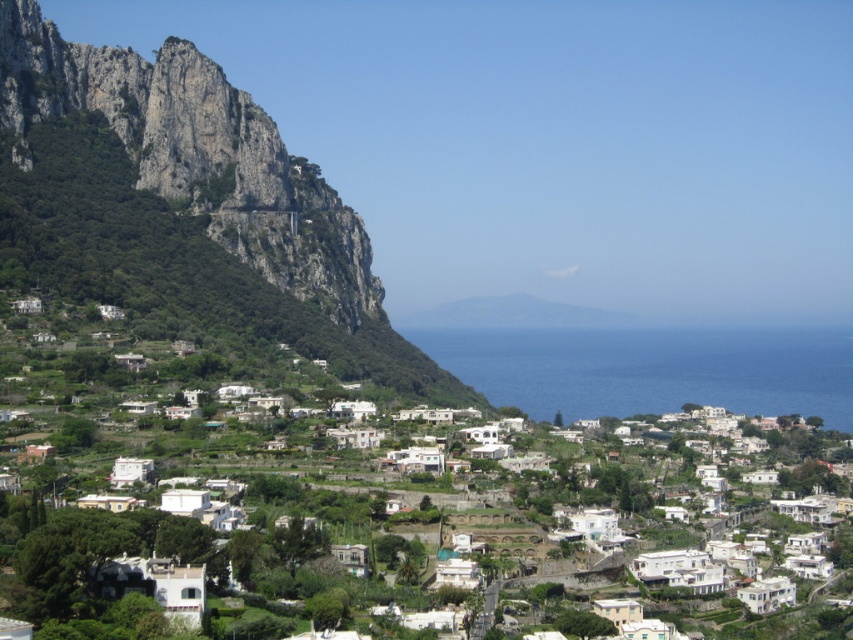
Does point (223, 83) come closer to viewer compared to point (712, 336)?

Yes, point (223, 83) is closer to viewer.

Does rugged stone mountain at left appear over white matte houses at center?

Correct, rugged stone mountain at left is located above white matte houses at center.

Measure the distance between rugged stone mountain at left and camera.

rugged stone mountain at left and camera are 820.08 feet apart.

Where is `rugged stone mountain at left`? The width and height of the screenshot is (853, 640). rugged stone mountain at left is located at coordinates (184, 204).

Can you confirm if rugged stone mountain at left is positioned above blue liquid water at center?

Indeed, rugged stone mountain at left is positioned over blue liquid water at center.

Which of these two, rugged stone mountain at left or blue liquid water at center, stands taller?

Standing taller between the two is rugged stone mountain at left.

I want to click on rugged stone mountain at left, so click(184, 204).

Image resolution: width=853 pixels, height=640 pixels. In order to click on rugged stone mountain at left in this screenshot , I will do `click(184, 204)`.

Looking at this image, measure the distance between white matte houses at center and blue liquid water at center.

white matte houses at center is 5.72 meters away from blue liquid water at center.

Is white matte houses at center taller than blue liquid water at center?

Indeed, white matte houses at center has a greater height compared to blue liquid water at center.

Measure the distance between white matte houses at center and camera.

white matte houses at center and camera are 198.93 meters apart from each other.

The height and width of the screenshot is (640, 853). In order to click on white matte houses at center in this screenshot , I will do `click(637, 358)`.